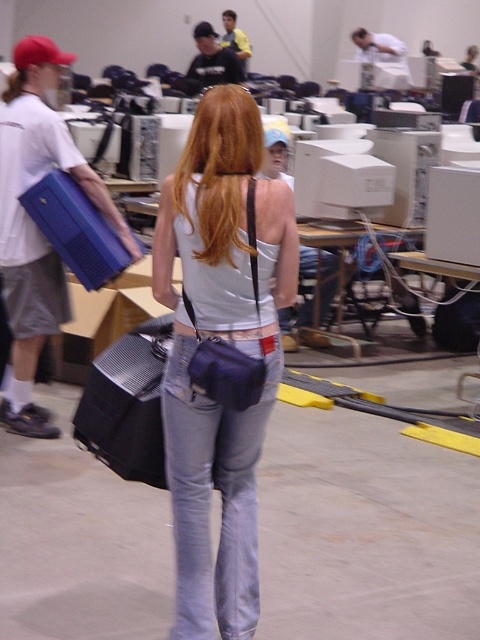
Question: Can you confirm if matte blue briefcase at left is bigger than blonde hair at center?

Choices:
 (A) no
 (B) yes

Answer: (B)

Question: Among these points, which one is nearest to the camera?

Choices:
 (A) (180, 204)
 (B) (232, 474)

Answer: (A)

Question: Which object is the closest to the denim at center?

Choices:
 (A) blonde hair at center
 (B) black fabric suitcase at center
 (C) matte blue briefcase at left

Answer: (B)

Question: Does denim at center have a smaller size compared to black fabric suitcase at center?

Choices:
 (A) yes
 (B) no

Answer: (A)

Question: Is denim at center positioned behind blonde hair at center?

Choices:
 (A) no
 (B) yes

Answer: (B)

Question: Which point is farther to the camera?

Choices:
 (A) denim at center
 (B) matte blue purse at center

Answer: (A)